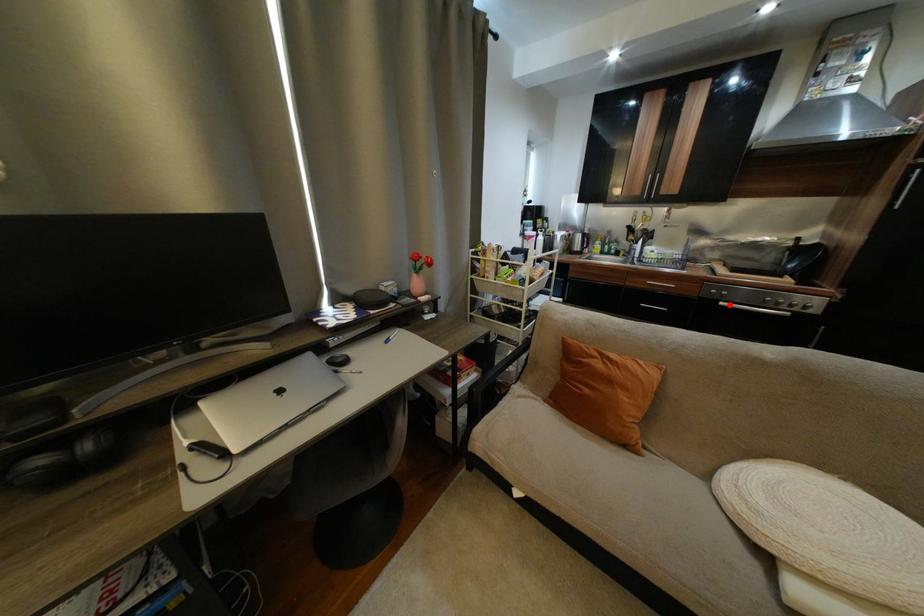
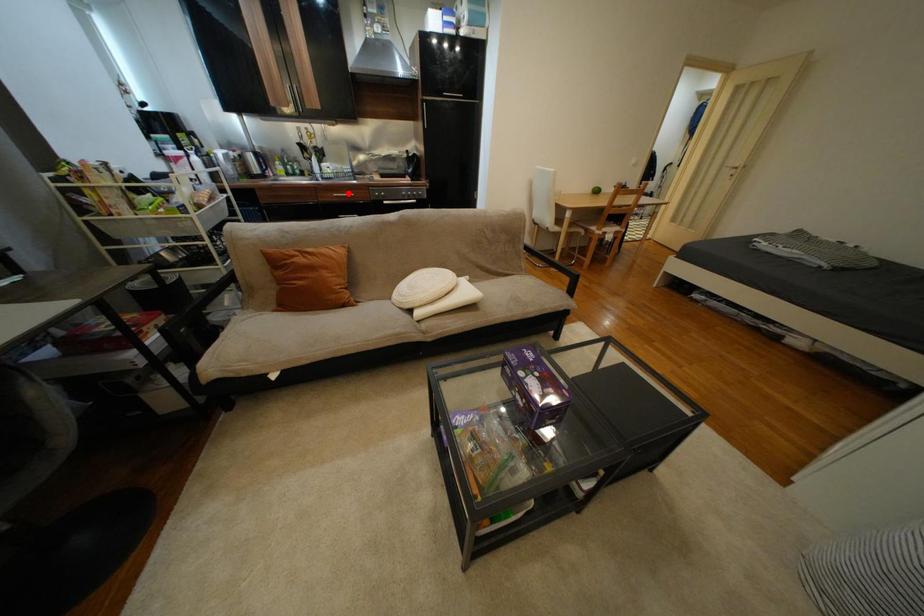
Based on the photo, I am providing you with two images of the same scene from different viewpoints. A red point is marked on the first image and another point is marked on the second image. Is the marked point in image1 the same physical position as the marked point in image2?

No